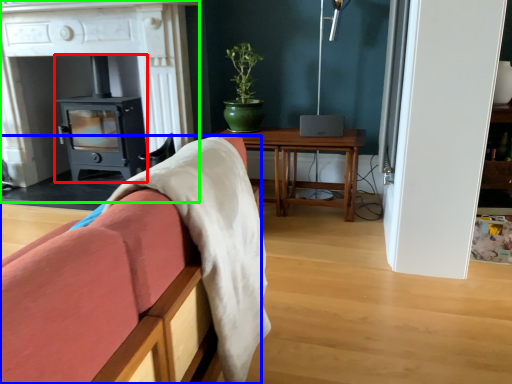
Question: Based on their relative distances, which object is farther from wood burning stove (highlighted by a red box)? Choose from furniture (highlighted by a blue box) and fireplace (highlighted by a green box).

Choices:
 (A) furniture
 (B) fireplace

Answer: (A)